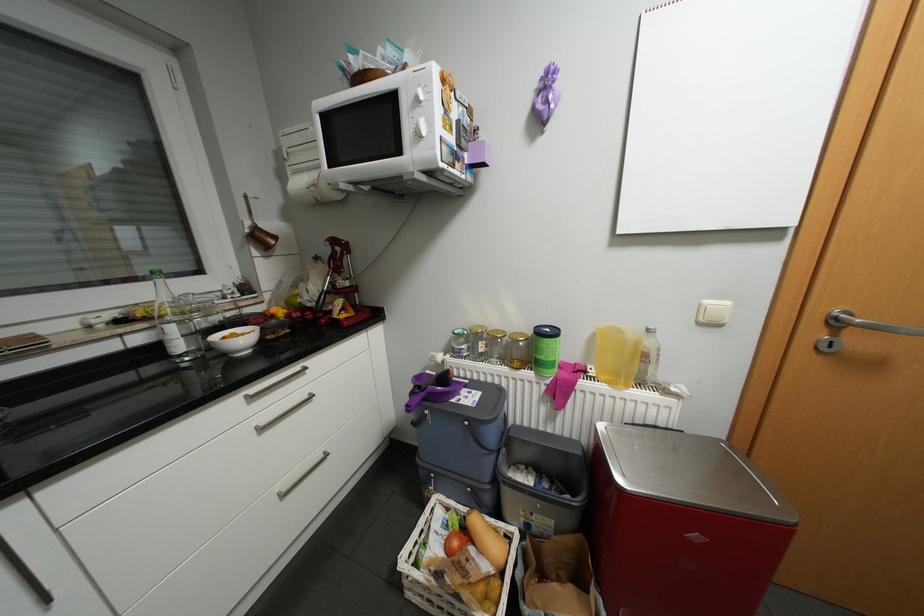
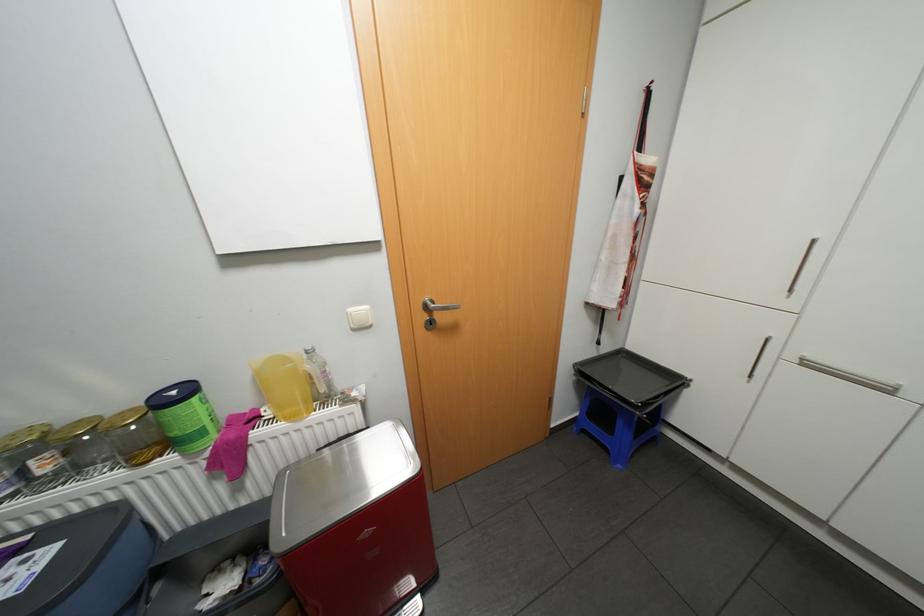
In the second image, find the point that corresponds to point 544,373 in the first image.

(190, 453)